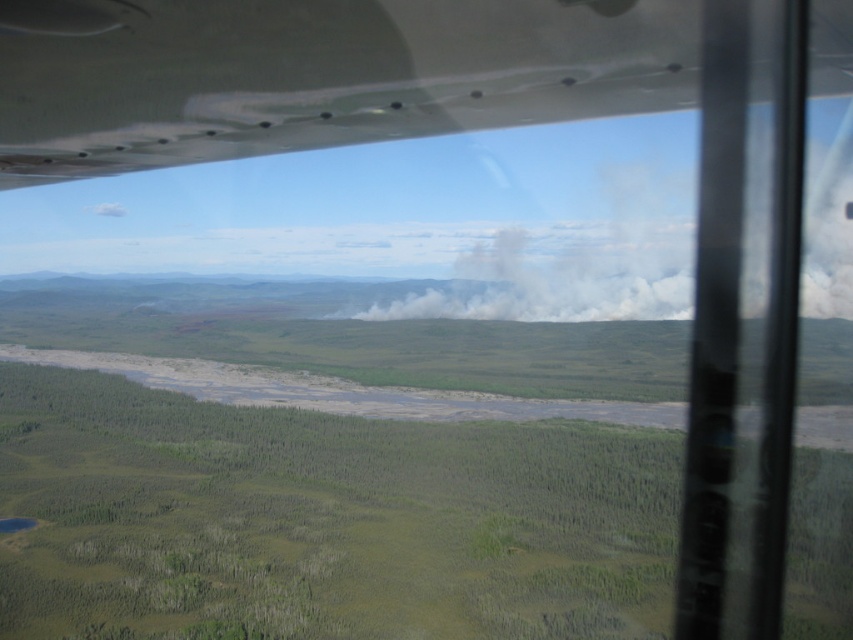
Question: Which object is farther from the camera taking this photo?

Choices:
 (A) white smoke at center
 (B) smooth white wing at upper left

Answer: (A)

Question: Where is smooth white wing at upper left located in relation to white smoke at center in the image?

Choices:
 (A) right
 (B) left

Answer: (B)

Question: Is smooth white wing at upper left to the left of white smoke at center from the viewer's perspective?

Choices:
 (A) yes
 (B) no

Answer: (A)

Question: Can you confirm if smooth white wing at upper left is positioned above white smoke at center?

Choices:
 (A) no
 (B) yes

Answer: (A)